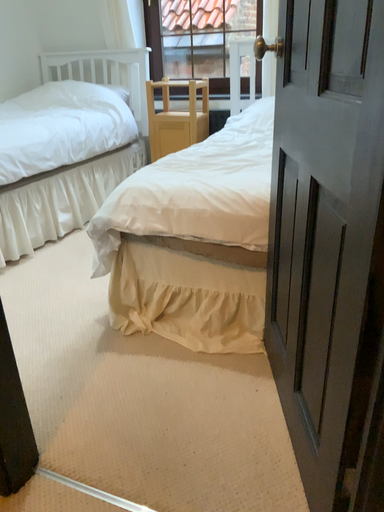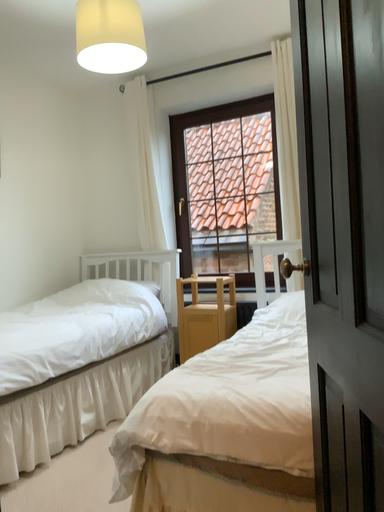
Question: Which way did the camera rotate in the video?

Choices:
 (A) rotated upward
 (B) rotated downward

Answer: (A)